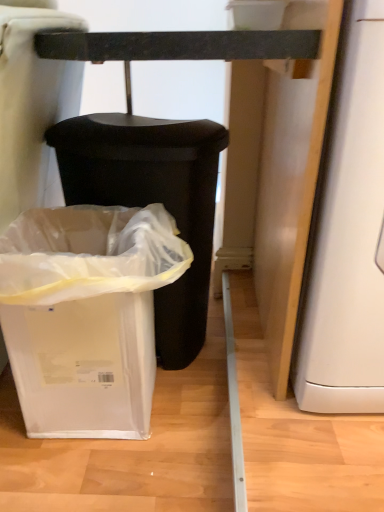
Question: In terms of height, does white plastic waste container at lower left, the 2th waste container viewed from the back, look taller or shorter compared to white plastic waste container at lower left, arranged as the 1th waste container when viewed from the back?

Choices:
 (A) tall
 (B) short

Answer: (B)

Question: Choose the correct answer: Is white plastic waste container at lower left, the 1th waste container in the front-to-back sequence, inside white plastic waste container at lower left, arranged as the 2th waste container when viewed from the front, or outside it?

Choices:
 (A) outside
 (B) inside

Answer: (A)

Question: In terms of size, does white plastic waste container at lower left, the 1th waste container in the front-to-back sequence, appear bigger or smaller than white plastic waste container at lower left, arranged as the 2th waste container when viewed from the front?

Choices:
 (A) small
 (B) big

Answer: (A)

Question: From the image's perspective, is white plastic waste container at lower left, arranged as the 2th waste container when viewed from the front, above or below white plastic waste container at lower left, the 1th waste container in the front-to-back sequence?

Choices:
 (A) above
 (B) below

Answer: (A)

Question: In terms of height, does white plastic waste container at lower left, arranged as the 2th waste container when viewed from the front, look taller or shorter compared to white plastic waste container at lower left, the 2th waste container viewed from the back?

Choices:
 (A) tall
 (B) short

Answer: (A)

Question: Is white plastic waste container at lower left, arranged as the 2th waste container when viewed from the front, spatially inside white plastic waste container at lower left, the 2th waste container viewed from the back, or outside of it?

Choices:
 (A) outside
 (B) inside

Answer: (A)

Question: From a real-world perspective, is white plastic waste container at lower left, arranged as the 2th waste container when viewed from the front, above or below white plastic waste container at lower left, the 2th waste container viewed from the back?

Choices:
 (A) above
 (B) below

Answer: (A)